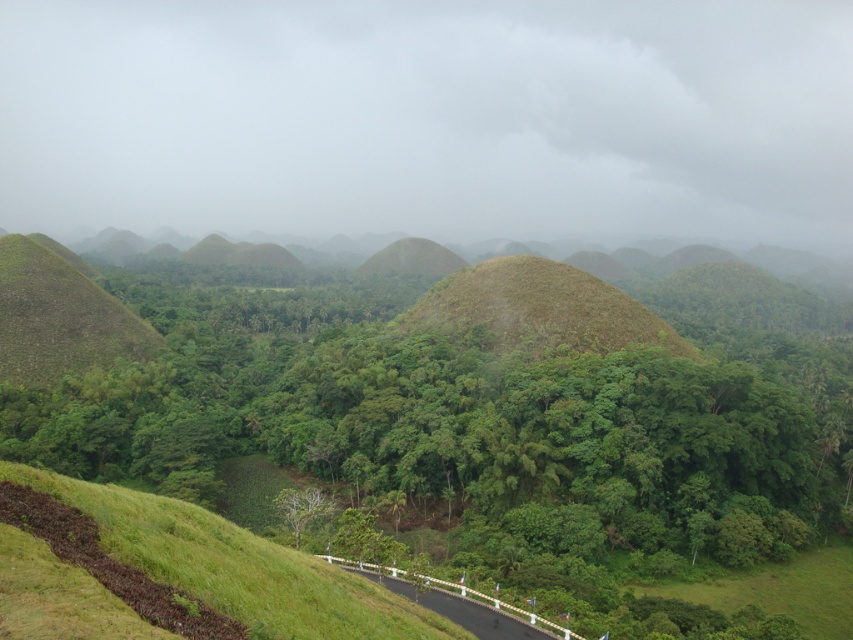
Question: Based on their relative distances, which object is farther from the brown grassy hill at center?

Choices:
 (A) green grassy hill at center
 (B) black asphalt road at lower center
 (C) green leafy tree at center

Answer: (B)

Question: Which point is farther from the camera taking this photo?

Choices:
 (A) (527, 346)
 (B) (357, 449)

Answer: (A)

Question: Does green grassy hill at center lie behind brown grassy hill at center?

Choices:
 (A) yes
 (B) no

Answer: (B)

Question: Is brown grassy hill at center positioned at the back of green leafy tree at center?

Choices:
 (A) no
 (B) yes

Answer: (B)

Question: Which point is farther from the camera taking this photo?

Choices:
 (A) pyautogui.click(x=405, y=458)
 (B) pyautogui.click(x=430, y=321)
 (C) pyautogui.click(x=505, y=637)
 (D) pyautogui.click(x=294, y=496)

Answer: (B)

Question: Is green grassy hill at center to the left of black asphalt road at lower center from the viewer's perspective?

Choices:
 (A) yes
 (B) no

Answer: (B)